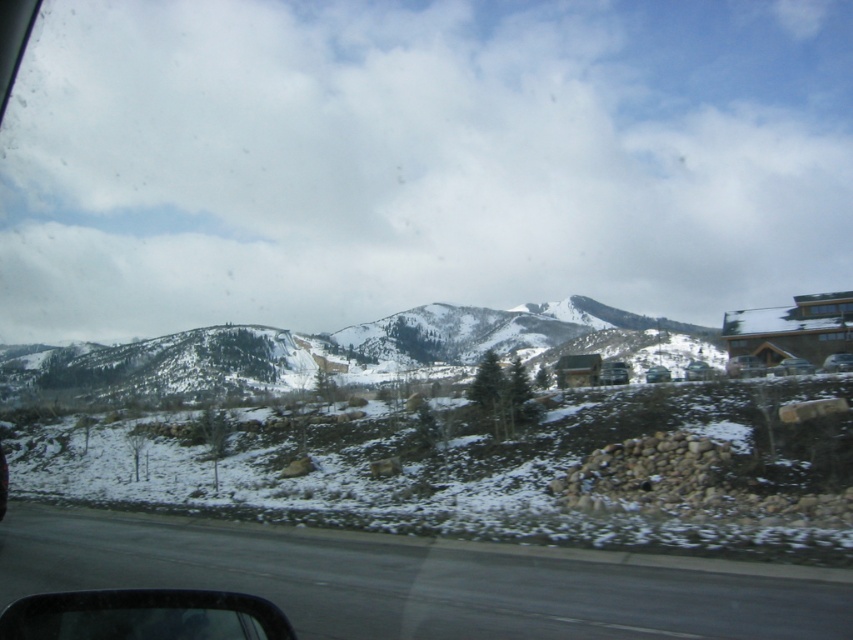
Can you confirm if metallic gray car at lower left is shorter than metallic silver car at center-right?

In fact, metallic gray car at lower left may be taller than metallic silver car at center-right.

Is point (1, 490) farther from viewer compared to point (648, 378)?

That is False.

Who is more distant from viewer, (3, 509) or (663, 371)?

Positioned behind is point (663, 371).

I want to click on metallic gray car at lower left, so (x=3, y=483).

Can you confirm if matte silver car at right is thinner than metallic gray car at lower left?

Correct, matte silver car at right's width is less than metallic gray car at lower left's.

Consider the image. Does matte silver car at right appear on the right side of metallic gray car at lower left?

Correct, you'll find matte silver car at right to the right of metallic gray car at lower left.

Between point (801, 372) and point (3, 480), which one is positioned in front?

Point (3, 480)

Identify the location of matte silver car at right. (792, 365).

You are a GUI agent. You are given a task and a screenshot of the screen. Output one action in this format:
    pyautogui.click(x=<x>, y=<y>)
    Task: Click on the transparent glass car window at lower left
    The height and width of the screenshot is (640, 853).
    Given the screenshot: What is the action you would take?
    pyautogui.click(x=143, y=616)

The width and height of the screenshot is (853, 640). Describe the element at coordinates (143, 616) in the screenshot. I see `transparent glass car window at lower left` at that location.

Identify the location of transparent glass car window at lower left. (143, 616).